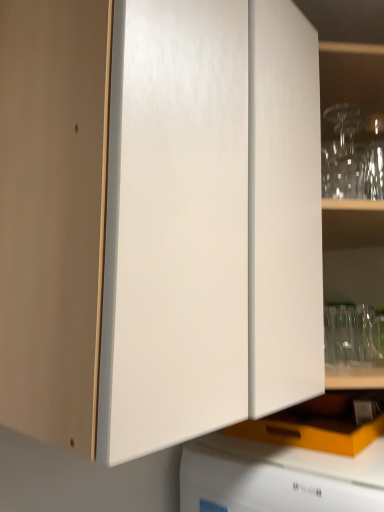
This screenshot has width=384, height=512. What do you see at coordinates (320, 423) in the screenshot? I see `orange matte drawer at lower center` at bounding box center [320, 423].

Measure the distance between point (342, 414) and camera.

Point (342, 414) and camera are 39.33 inches apart from each other.

The width and height of the screenshot is (384, 512). Identify the location of orange matte drawer at lower center. (320, 423).

I want to click on orange matte drawer at lower center, so coord(320,423).